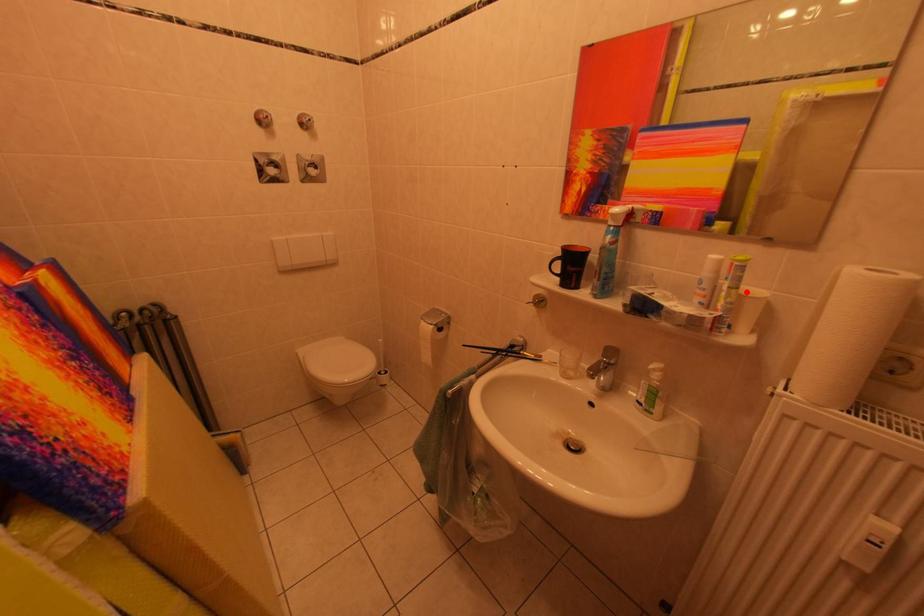
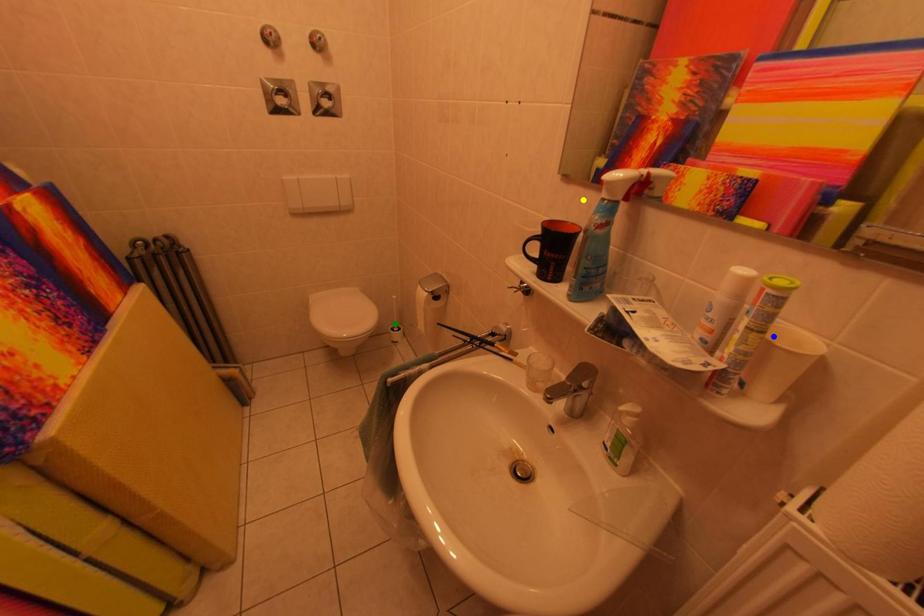
Question: I am providing you with two images of the same scene from different viewpoints. A red point is marked on the first image. You are given multiple points on the second image. Which point in image 2 represents the same 3d spot as the red point in image 1?

Choices:
 (A) green point
 (B) blue point
 (C) yellow point

Answer: (B)